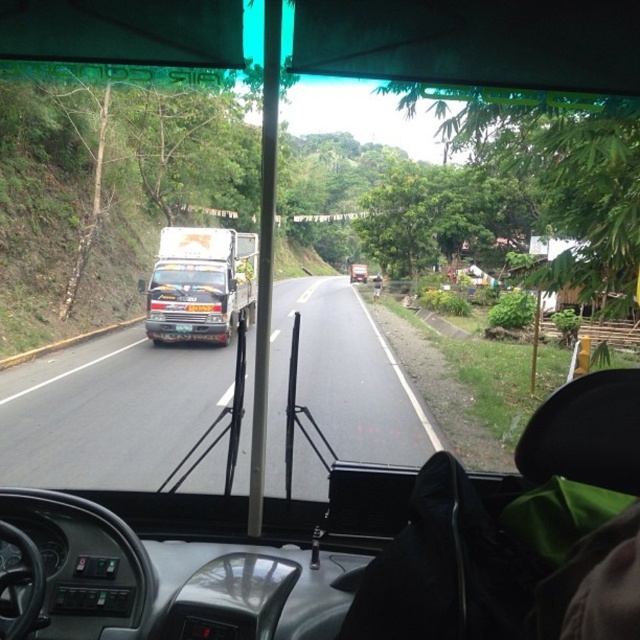
Question: Does black matte truck at left have a smaller size compared to metallic silver truck at center?

Choices:
 (A) no
 (B) yes

Answer: (A)

Question: Does black matte truck at left have a greater width compared to metallic silver truck at center?

Choices:
 (A) yes
 (B) no

Answer: (A)

Question: Which point is closer to the camera taking this photo?

Choices:
 (A) (145, 442)
 (B) (189, 280)

Answer: (A)

Question: Which object is farther from the camera taking this photo?

Choices:
 (A) metallic silver truck at center
 (B) black matte truck at left

Answer: (A)

Question: Does black matte truck at left appear under metallic silver truck at center?

Choices:
 (A) yes
 (B) no

Answer: (A)